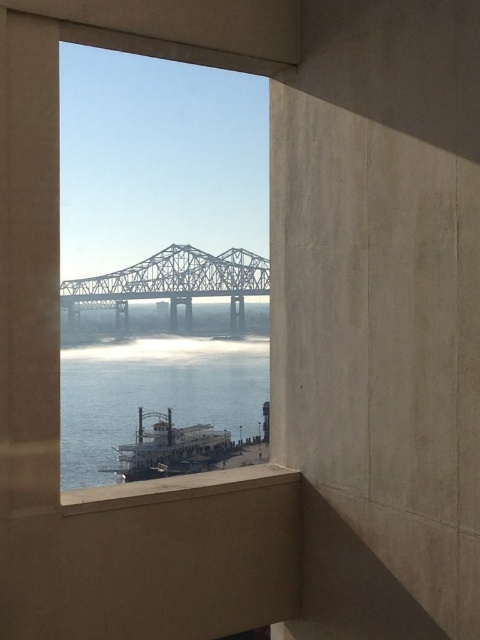
In the scene shown: You are standing in a room with the clear glass window at center and looking at the white wooden boat at lower center through it. Can you tell me which object is nearer to you?

The clear glass window at center is closer to the viewer than the white wooden boat at lower center, so the clear glass window at center is nearer to you.

You are standing inside the building and looking through the clear glass window at center. There is clear water at lower center outside. From your perspective, which object is on the right side?

The clear glass window at center is positioned on the right side of clear water at lower center, so the clear glass window at center is on the right side.